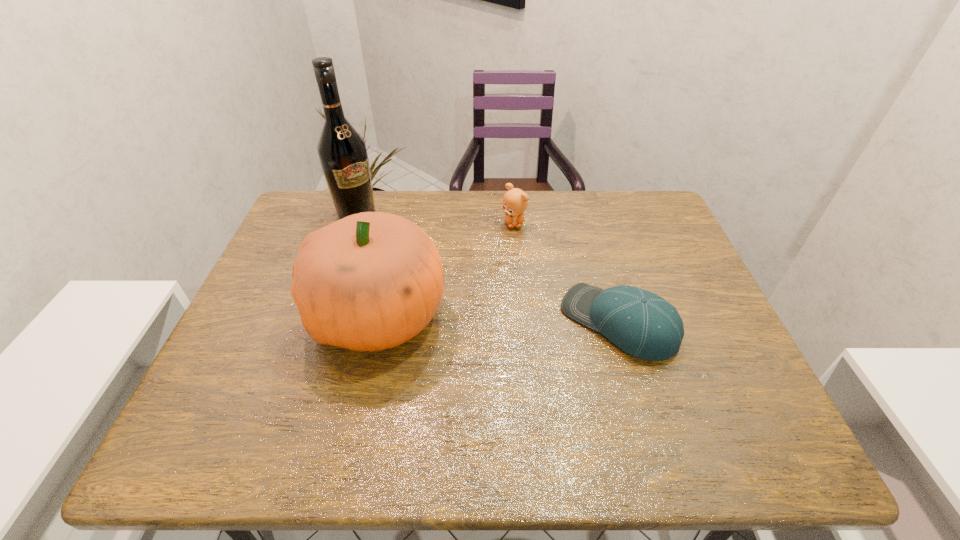
Where is `vacant spot on the desktop that is between the pumpkin and the rightmost object and is positioned on the label of the wine bottle`? The height and width of the screenshot is (540, 960). vacant spot on the desktop that is between the pumpkin and the rightmost object and is positioned on the label of the wine bottle is located at coordinates (468, 317).

Find the location of a particular element. free space on the desktop that is between the third shortest object and the baseball cap and is positioned on the face of the third object from left to right is located at coordinates [x=524, y=319].